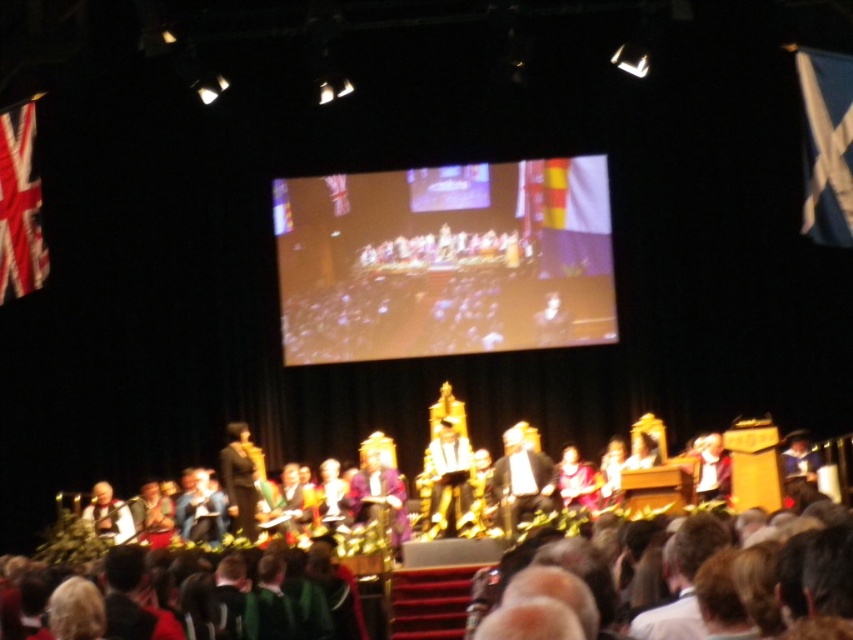
Question: Does silk white robe at center appear under purple velvet robe at center?

Choices:
 (A) yes
 (B) no

Answer: (B)

Question: Which point is farther to the camera?

Choices:
 (A) (100, 529)
 (B) (728, 486)

Answer: (A)

Question: Which point is closer to the camera?

Choices:
 (A) (102, 518)
 (B) (254, 476)

Answer: (A)

Question: Can you confirm if silk white robe at center is positioned below dark brown suit at center?

Choices:
 (A) no
 (B) yes

Answer: (B)

Question: Based on their relative distances, which object is farther from the dark brown suit at center?

Choices:
 (A) white fabric at center
 (B) silk white robe at center

Answer: (A)

Question: Observing the image, what is the correct spatial positioning of dark brown suit at center in reference to white fabric jacket at lower left?

Choices:
 (A) right
 (B) left

Answer: (A)